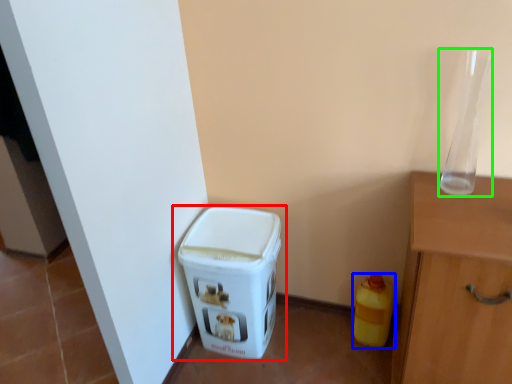
Question: Estimate the real-world distances between objects in this image. Which object is closer to waste container (highlighted by a red box), bottle (highlighted by a blue box) or glass vase (highlighted by a green box)?

Choices:
 (A) bottle
 (B) glass vase

Answer: (A)